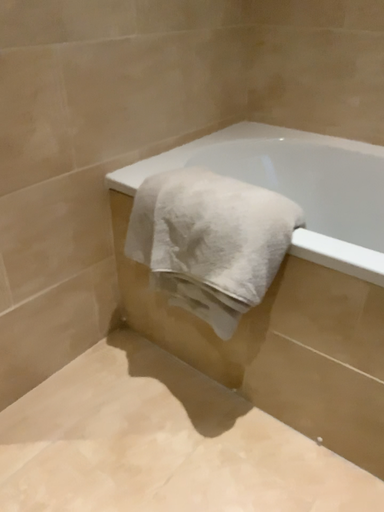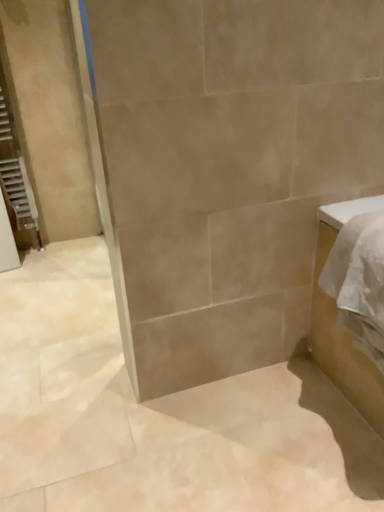
Question: How did the camera likely rotate when shooting the video?

Choices:
 (A) rotated downward
 (B) rotated upward

Answer: (B)